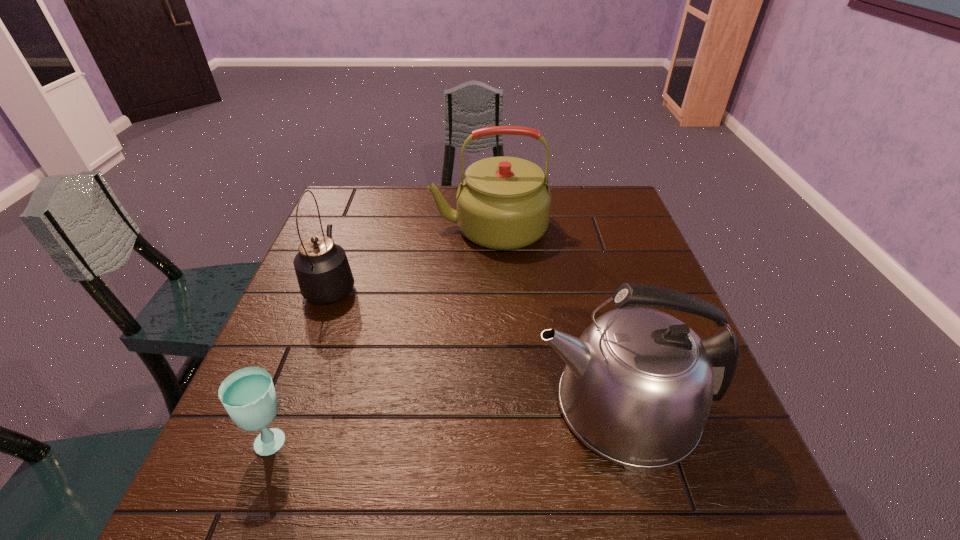
At what (x,y) coordinates should I click in order to perform the action: click on vacant space that is in between the nearest kettle and the glass. Please return your answer as a coordinate pair (x, y). Image resolution: width=960 pixels, height=540 pixels. Looking at the image, I should click on (449, 423).

Locate an element on the screen. This screenshot has width=960, height=540. free space between the third nearest object and the farthest kettle is located at coordinates [x=410, y=256].

Identify the location of empty location between the farthest object and the nearest kettle. The width and height of the screenshot is (960, 540). (556, 317).

Locate an element on the screen. vacant region between the farthest object and the leftmost kettle is located at coordinates (410, 256).

Where is `free space between the shortest object and the second nearest kettle`? This screenshot has height=540, width=960. free space between the shortest object and the second nearest kettle is located at coordinates (303, 362).

The width and height of the screenshot is (960, 540). What are the coordinates of `free space between the second farthest kettle and the nearest kettle` in the screenshot? It's located at (477, 345).

Identify the location of free space between the nearest kettle and the farthest kettle. The image size is (960, 540). (556, 317).

The height and width of the screenshot is (540, 960). Identify the location of free point between the farthest kettle and the second farthest kettle. (410, 256).

I want to click on object identified as the closest to the nearest kettle, so click(503, 203).

Select which object is the third closest to the farthest kettle. Please provide its 2D coordinates. Your answer should be formatted as a tuple, i.e. [(x, y)], where the tuple contains the x and y coordinates of a point satisfying the conditions above.

[(248, 394)]